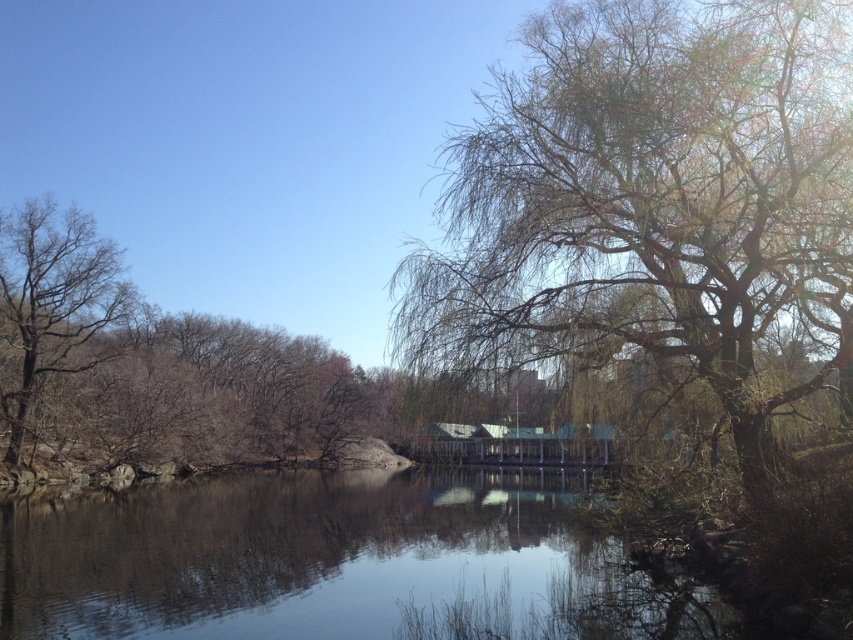
You are standing on the bank of the serene natural scene and want to determine which object is taller between the smooth reflective water at center and the bare wood tree at left. Based on the scene description, which one is taller?

The smooth reflective water at center has a lesser height compared to the bare wood tree at left, so the bare wood tree at left is taller.

You are standing at the center of the image and want to locate the bare branches at right. Which direction should you look to find them?

The bare branches at right are located at the right side of the image, so you should look to your right to find them.

Based on the photo, you are a painter wanting to capture the scene. You have a canvas that can only fit objects up to the width of the bare wood tree at left. Can you fit the smooth reflective water at center on your canvas?

The smooth reflective water at center is wider than the bare wood tree at left. Since your canvas can only fit up to the width of the bare wood tree at left, the smooth reflective water at center cannot fit on the canvas.